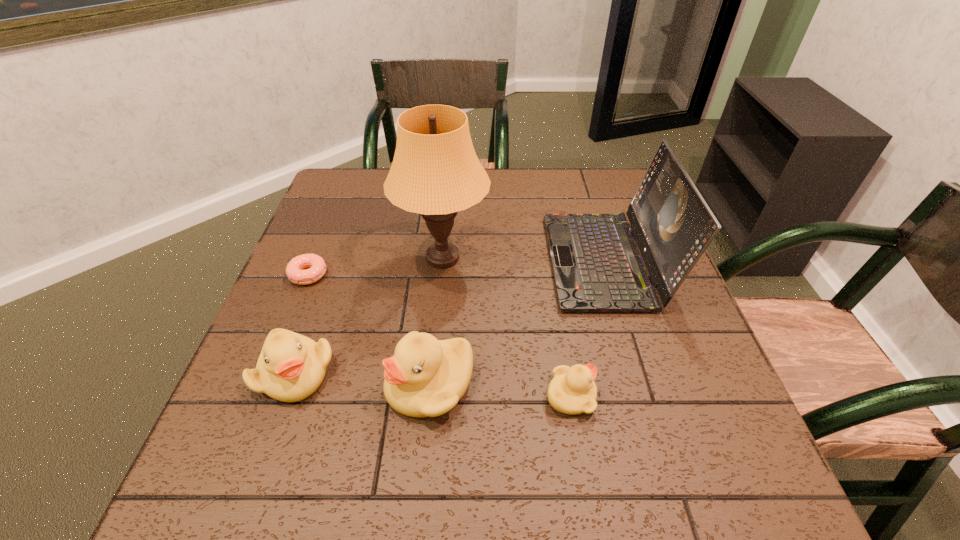
What are the coordinates of `vacant space that is in between the second duckling from right to left and the lampshade` in the screenshot? It's located at (437, 321).

Find the location of a particular element. The height and width of the screenshot is (540, 960). free space between the second duckling from right to left and the laptop computer is located at coordinates (517, 323).

Where is `free area in between the fourth tallest object and the laptop computer`? This screenshot has height=540, width=960. free area in between the fourth tallest object and the laptop computer is located at coordinates (450, 317).

Locate an element on the screen. The image size is (960, 540). empty location between the doughnut and the second shortest duckling is located at coordinates (301, 324).

I want to click on object that is the fourth closest one to the laptop computer, so click(x=291, y=367).

Choose which object is the nearest neighbor to the second tallest object. Please provide its 2D coordinates. Your answer should be formatted as a tuple, i.e. [(x, y)], where the tuple contains the x and y coordinates of a point satisfying the conditions above.

[(435, 172)]

Select which duckling is the closest to the doughnut. Please provide its 2D coordinates. Your answer should be formatted as a tuple, i.e. [(x, y)], where the tuple contains the x and y coordinates of a point satisfying the conditions above.

[(291, 367)]

You are a GUI agent. You are given a task and a screenshot of the screen. Output one action in this format:
    pyautogui.click(x=<x>, y=<y>)
    Task: Click on the duckling that is the second nearest to the leftmost duckling
    
    Given the screenshot: What is the action you would take?
    pyautogui.click(x=572, y=391)

In order to click on free location that satisfies the following two spatial constraints: 1. on the screen of the second tallest object; 2. on the front side of the shortest object in this screenshot , I will do point(609,274).

At what (x,y) coordinates should I click in order to perform the action: click on blank area in the image that satisfies the following two spatial constraints: 1. on the screen of the laptop computer; 2. on the front-facing side of the leftmost duckling. Please return your answer as a coordinate pair (x, y). Looking at the image, I should click on (638, 373).